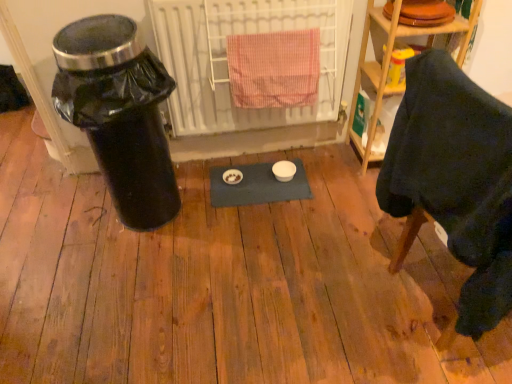
Question: Could you tell me if dark fabric chair at lower right is turned towards white metal radiator at center?

Choices:
 (A) yes
 (B) no

Answer: (B)

Question: Is white metal radiator at center completely or partially inside dark fabric chair at lower right?

Choices:
 (A) yes
 (B) no

Answer: (B)

Question: Is dark fabric chair at lower right at the right side of white metal radiator at center?

Choices:
 (A) no
 (B) yes

Answer: (B)

Question: Considering the relative sizes of dark fabric chair at lower right and white metal radiator at center in the image provided, is dark fabric chair at lower right smaller than white metal radiator at center?

Choices:
 (A) yes
 (B) no

Answer: (B)

Question: Can you confirm if dark fabric chair at lower right is wider than white metal radiator at center?

Choices:
 (A) yes
 (B) no

Answer: (A)

Question: Considering the positions of dark fabric chair at lower right and white metal radiator at center in the image, is dark fabric chair at lower right taller or shorter than white metal radiator at center?

Choices:
 (A) short
 (B) tall

Answer: (B)

Question: Visually, is dark fabric chair at lower right positioned to the left or to the right of white metal radiator at center?

Choices:
 (A) right
 (B) left

Answer: (A)

Question: From the image's perspective, is dark fabric chair at lower right above or below white metal radiator at center?

Choices:
 (A) above
 (B) below

Answer: (B)

Question: From a real-world perspective, relative to white metal radiator at center, is dark fabric chair at lower right vertically above or below?

Choices:
 (A) below
 (B) above

Answer: (A)

Question: From a real-world perspective, relative to black plastic trash can at left, is dark fabric chair at lower right vertically above or below?

Choices:
 (A) above
 (B) below

Answer: (A)

Question: Considering the positions of point (410, 192) and point (92, 139), is point (410, 192) closer or farther from the camera than point (92, 139)?

Choices:
 (A) closer
 (B) farther

Answer: (A)

Question: In the image, is dark fabric chair at lower right on the left side or the right side of black plastic trash can at left?

Choices:
 (A) left
 (B) right

Answer: (B)

Question: Based on their sizes in the image, would you say dark fabric chair at lower right is bigger or smaller than black plastic trash can at left?

Choices:
 (A) big
 (B) small

Answer: (A)

Question: Based on their sizes in the image, would you say pink checkered towel at center is bigger or smaller than white metal radiator at center?

Choices:
 (A) small
 (B) big

Answer: (A)

Question: Based on their positions, is pink checkered towel at center located to the left or right of white metal radiator at center?

Choices:
 (A) left
 (B) right

Answer: (B)